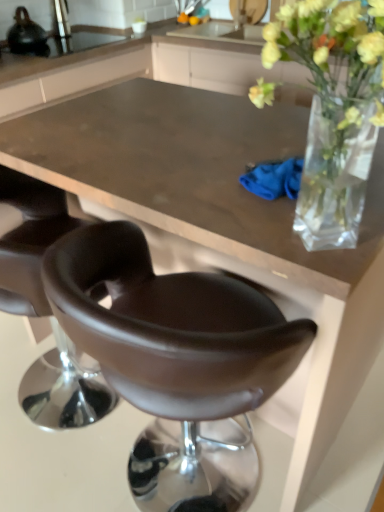
Question: Does point (198, 439) appear closer or farther from the camera than point (36, 45)?

Choices:
 (A) closer
 (B) farther

Answer: (A)

Question: From a real-world perspective, is brown leather chair at center, which is the second chair from left to right, physically located above or below shiny black kettle at upper left?

Choices:
 (A) above
 (B) below

Answer: (B)

Question: Considering the real-world distances, which object is farthest from the translucent glass vase at upper right?

Choices:
 (A) leather-like brown chair at lower left, the first chair when ordered from left to right
 (B) brown leather chair at center, placed as the 1th chair when sorted from right to left
 (C) shiny black kettle at upper left

Answer: (C)

Question: Estimate the real-world distances between objects in this image. Which object is closer to the leather-like brown chair at lower left, which is the second chair from right to left?

Choices:
 (A) brown leather chair at center, which is the second chair from left to right
 (B) translucent glass vase at upper right
 (C) shiny black kettle at upper left

Answer: (A)